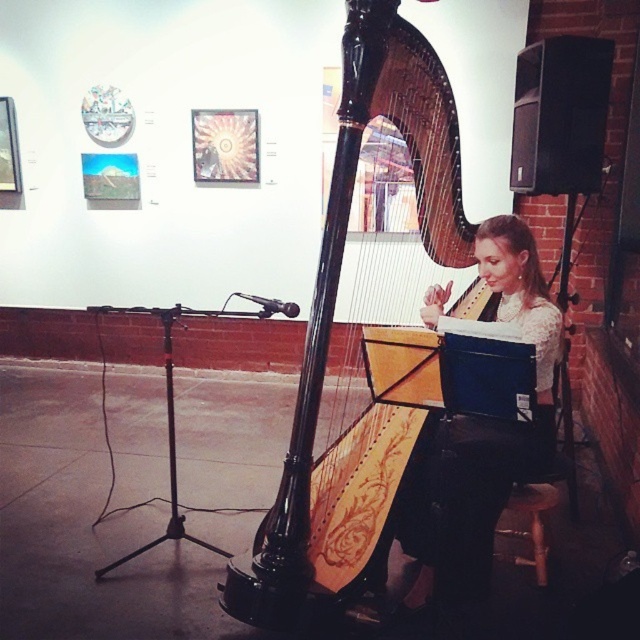
Question: Can you confirm if matte black harpist at center is positioned above wooden stool at lower right?

Choices:
 (A) no
 (B) yes

Answer: (B)

Question: Which of the following is the farthest from the observer?

Choices:
 (A) (394, 44)
 (B) (532, 531)

Answer: (B)

Question: Which point is closer to the camera taking this photo?

Choices:
 (A) (328, 264)
 (B) (545, 582)

Answer: (A)

Question: Is black polished wood harp at center to the left of wooden stool at lower right from the viewer's perspective?

Choices:
 (A) yes
 (B) no

Answer: (A)

Question: Is black polished wood harp at center behind matte black harpist at center?

Choices:
 (A) yes
 (B) no

Answer: (A)

Question: Which point appears closest to the camera in this image?

Choices:
 (A) (538, 528)
 (B) (451, 132)
 (C) (448, 545)

Answer: (B)